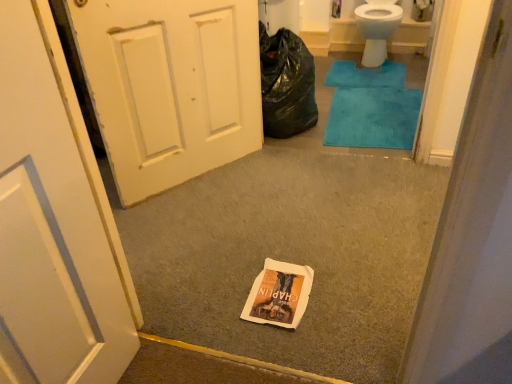
The image size is (512, 384). Identify the location of vacant area that is in front of white painted wood door at left. (209, 223).